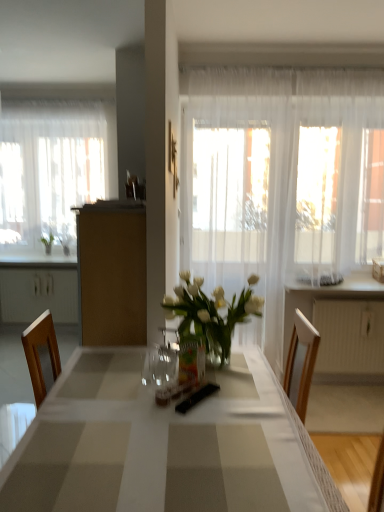
Question: Is sheer white curtain at left, the 1th curtain when ordered from left to right, positioned far away from brown matte cabinet at center?

Choices:
 (A) yes
 (B) no

Answer: (A)

Question: Does sheer white curtain at left, the 2th curtain viewed from the right, appear on the left side of brown matte cabinet at center?

Choices:
 (A) no
 (B) yes

Answer: (B)

Question: Is sheer white curtain at left, which ranks as the second curtain in front-to-back order, outside of brown matte cabinet at center?

Choices:
 (A) yes
 (B) no

Answer: (A)

Question: From the image's perspective, is sheer white curtain at left, positioned as the 1th curtain in back-to-front order, under brown matte cabinet at center?

Choices:
 (A) yes
 (B) no

Answer: (B)

Question: Is sheer white curtain at left, the 2th curtain viewed from the right, further to camera compared to brown matte cabinet at center?

Choices:
 (A) no
 (B) yes

Answer: (B)

Question: Is sheer white curtain at left, which ranks as the second curtain in front-to-back order, to the right of brown matte cabinet at center from the viewer's perspective?

Choices:
 (A) no
 (B) yes

Answer: (A)

Question: From a real-world perspective, is sheer white curtain at left, the 1th curtain when ordered from left to right, physically below white glossy table at center?

Choices:
 (A) yes
 (B) no

Answer: (B)

Question: Is the position of sheer white curtain at left, which ranks as the second curtain in front-to-back order, more distant than that of white glossy table at center?

Choices:
 (A) no
 (B) yes

Answer: (B)

Question: Does sheer white curtain at left, the 1th curtain when ordered from left to right, have a lesser width compared to white glossy table at center?

Choices:
 (A) yes
 (B) no

Answer: (A)

Question: From a real-world perspective, is sheer white curtain at left, the 2th curtain viewed from the right, located higher than white glossy table at center?

Choices:
 (A) no
 (B) yes

Answer: (B)

Question: From the image's perspective, is sheer white curtain at left, positioned as the 1th curtain in back-to-front order, above white glossy table at center?

Choices:
 (A) yes
 (B) no

Answer: (A)

Question: Considering the relative positions of sheer white curtain at left, the 2th curtain viewed from the right, and white glossy table at center in the image provided, is sheer white curtain at left, the 2th curtain viewed from the right, to the left of white glossy table at center from the viewer's perspective?

Choices:
 (A) no
 (B) yes

Answer: (B)

Question: Considering the relative positions of white plastic radiator at right and brown matte cabinet at center in the image provided, is white plastic radiator at right to the right of brown matte cabinet at center from the viewer's perspective?

Choices:
 (A) no
 (B) yes

Answer: (B)